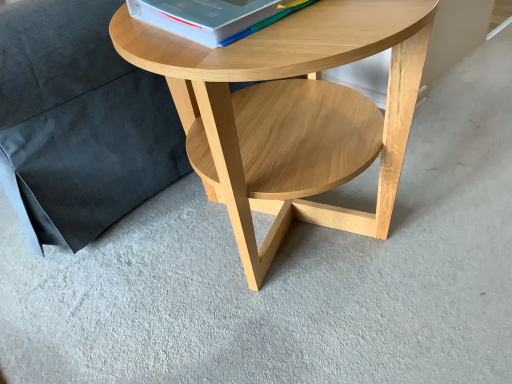
Locate an element on the screen. The image size is (512, 384). black fabric pillow at upper left is located at coordinates (79, 123).

Considering the relative positions of black fabric pillow at upper left and natural wood coffee table at center in the image provided, is black fabric pillow at upper left to the left of natural wood coffee table at center from the viewer's perspective?

Indeed, black fabric pillow at upper left is positioned on the left side of natural wood coffee table at center.

Is black fabric pillow at upper left with natural wood coffee table at center?

No, black fabric pillow at upper left is not beside natural wood coffee table at center.

Can we say black fabric pillow at upper left lies outside natural wood coffee table at center?

Yes, black fabric pillow at upper left is outside of natural wood coffee table at center.

Is natural wood coffee table at center far away from white paper at upper center?

No, natural wood coffee table at center is not far from white paper at upper center.

From the image's perspective, is natural wood coffee table at center under white paper at upper center?

Yes, from the image's perspective, natural wood coffee table at center is below white paper at upper center.

Is point (268, 139) behind point (216, 45)?

Yes, point (268, 139) is behind point (216, 45).

Which is more to the left, natural wood coffee table at center or white paper at upper center?

Positioned to the left is white paper at upper center.

In the image, is white paper at upper center positioned in front of or behind natural wood coffee table at center?

Clearly, white paper at upper center is behind natural wood coffee table at center.

What's the angular difference between white paper at upper center and natural wood coffee table at center's facing directions?

2.71 degrees separate the facing orientations of white paper at upper center and natural wood coffee table at center.

Where is `paperback book that is behind the natural wood coffee table at center`? Image resolution: width=512 pixels, height=384 pixels. paperback book that is behind the natural wood coffee table at center is located at coordinates (211, 17).

Between white paper at upper center and natural wood coffee table at center, which one has less height?

white paper at upper center.

Based on their positions, is black fabric pillow at upper left located to the left or right of white paper at upper center?

In the image, black fabric pillow at upper left appears on the left side of white paper at upper center.

Measure the distance between black fabric pillow at upper left and white paper at upper center.

black fabric pillow at upper left and white paper at upper center are 15.51 inches apart.

Is black fabric pillow at upper left not close to white paper at upper center?

No, black fabric pillow at upper left is not far from white paper at upper center.

Considering their positions, is natural wood coffee table at center located in front of or behind black fabric pillow at upper left?

In the image, natural wood coffee table at center appears in front of black fabric pillow at upper left.

From the image's perspective, is natural wood coffee table at center located above black fabric pillow at upper left?

Actually, natural wood coffee table at center appears below black fabric pillow at upper left in the image.

Which is more to the right, natural wood coffee table at center or black fabric pillow at upper left?

Positioned to the right is natural wood coffee table at center.

Can you tell me how much white paper at upper center and black fabric pillow at upper left differ in facing direction?

2.71 degrees.

Which is more to the right, white paper at upper center or black fabric pillow at upper left?

Positioned to the right is white paper at upper center.

Can you confirm if white paper at upper center is smaller than black fabric pillow at upper left?

Yes, white paper at upper center is smaller than black fabric pillow at upper left.

Which point is more distant from viewer, (x=232, y=26) or (x=87, y=229)?

Point (x=87, y=229)

At what (x,y) coordinates should I click in order to perform the action: click on coffee table that appears below the black fabric pillow at upper left (from a real-world perspective). Please return your answer as a coordinate pair (x, y). The height and width of the screenshot is (384, 512). Looking at the image, I should click on (291, 113).

I want to click on paperback book above the natural wood coffee table at center (from a real-world perspective), so click(x=211, y=17).

Considering their positions, is black fabric pillow at upper left positioned closer to white paper at upper center than natural wood coffee table at center?

natural wood coffee table at center is closer to white paper at upper center.

Considering their positions, is black fabric pillow at upper left positioned further to natural wood coffee table at center than white paper at upper center?

Among the two, black fabric pillow at upper left is located further to natural wood coffee table at center.

Based on their spatial positions, is white paper at upper center or black fabric pillow at upper left closer to natural wood coffee table at center?

white paper at upper center.

Estimate the real-world distances between objects in this image. Which object is further from black fabric pillow at upper left, natural wood coffee table at center or white paper at upper center?

white paper at upper center is positioned further to the anchor black fabric pillow at upper left.

Looking at the image, which one is located closer to white paper at upper center, natural wood coffee table at center or black fabric pillow at upper left?

Among the two, natural wood coffee table at center is located nearer to white paper at upper center.

Based on their spatial positions, is white paper at upper center or natural wood coffee table at center closer to black fabric pillow at upper left?

natural wood coffee table at center is positioned closer to the anchor black fabric pillow at upper left.

Identify the location of paperback book situated between black fabric pillow at upper left and natural wood coffee table at center from left to right. The height and width of the screenshot is (384, 512). pyautogui.click(x=211, y=17).